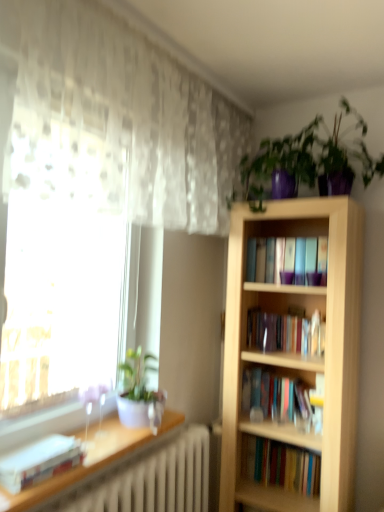
Locate an element on the screen. The image size is (384, 512). translucent fabric at left is located at coordinates (61, 301).

In order to click on light wood bookcase at right in this screenshot , I will do `click(296, 353)`.

The width and height of the screenshot is (384, 512). What are the coordinates of `shiny purple pot at upper right, which is counted as the 2th houseplant, starting from the bottom` in the screenshot? It's located at (310, 159).

From a real-world perspective, is white glossy shelf at lower left above or below shiny purple pot at upper right, the second houseplant positioned from the left?

Clearly, from a real-world perspective, white glossy shelf at lower left is below shiny purple pot at upper right, the second houseplant positioned from the left.

What's the angular difference between white glossy shelf at lower left and shiny purple pot at upper right, the first houseplant viewed from the top,'s facing directions?

There is a 89.1-degree angle between the facing directions of white glossy shelf at lower left and shiny purple pot at upper right, the first houseplant viewed from the top.

Is white glossy shelf at lower left spatially inside shiny purple pot at upper right, the first houseplant viewed from the top, or outside of it?

white glossy shelf at lower left cannot be found inside shiny purple pot at upper right, the first houseplant viewed from the top.

Based on the photo, is white glossy shelf at lower left looking in the opposite direction of shiny purple pot at upper right, the second houseplant positioned from the left?

No, white glossy shelf at lower left is not facing the opposite direction of shiny purple pot at upper right, the second houseplant positioned from the left.

Considering the points (133, 353) and (49, 489), which point is behind, point (133, 353) or point (49, 489)?

The point (133, 353) is more distant.

Which is more to the left, white glossy pot at left, marked as the 1th houseplant in a bottom-to-top arrangement, or white glossy shelf at lower left?

Positioned to the left is white glossy shelf at lower left.

From a real-world perspective, is white glossy pot at left, which appears as the first houseplant when viewed from the left, over white glossy shelf at lower left?

Yes, from a real-world perspective, white glossy pot at left, which appears as the first houseplant when viewed from the left, is above white glossy shelf at lower left.

Considering the positions of points (353, 261) and (106, 423), is point (353, 261) closer to camera compared to point (106, 423)?

No, (353, 261) is further to viewer.

From the image's perspective, which is above, light wood bookcase at right or white glossy shelf at lower left?

From the image's view, light wood bookcase at right is above.

Based on the photo, between light wood bookcase at right and white glossy shelf at lower left, which one appears on the left side from the viewer's perspective?

From the viewer's perspective, white glossy shelf at lower left appears more on the left side.

Looking at this image, how far apart are light wood bookcase at right and white glossy shelf at lower left?

The distance of light wood bookcase at right from white glossy shelf at lower left is 31.46 inches.

Considering the sizes of white glossy pot at left, marked as the 1th houseplant in a bottom-to-top arrangement, and shiny purple pot at upper right, marked as the 1th houseplant in a right-to-left arrangement, in the image, is white glossy pot at left, marked as the 1th houseplant in a bottom-to-top arrangement, taller or shorter than shiny purple pot at upper right, marked as the 1th houseplant in a right-to-left arrangement,?

white glossy pot at left, marked as the 1th houseplant in a bottom-to-top arrangement, is shorter than shiny purple pot at upper right, marked as the 1th houseplant in a right-to-left arrangement.

Is white glossy pot at left, which appears as the first houseplant when viewed from the left, looking in the opposite direction of shiny purple pot at upper right, marked as the 1th houseplant in a right-to-left arrangement?

That's not correct — white glossy pot at left, which appears as the first houseplant when viewed from the left, is not looking away from shiny purple pot at upper right, marked as the 1th houseplant in a right-to-left arrangement.

From the image's perspective, is white glossy pot at left, marked as the 2th houseplant in a right-to-left arrangement, located above or below shiny purple pot at upper right, the second houseplant positioned from the left?

From the image's perspective, white glossy pot at left, marked as the 2th houseplant in a right-to-left arrangement, appears below shiny purple pot at upper right, the second houseplant positioned from the left.

From a real-world perspective, between light wood bookcase at right and white glossy pot at left, marked as the 2th houseplant in a right-to-left arrangement, who is vertically lower?

light wood bookcase at right.

Considering the positions of objects light wood bookcase at right and white glossy pot at left, marked as the 2th houseplant in a top-to-bottom arrangement, in the image provided, who is more to the left, light wood bookcase at right or white glossy pot at left, marked as the 2th houseplant in a top-to-bottom arrangement,?

white glossy pot at left, marked as the 2th houseplant in a top-to-bottom arrangement, is more to the left.

From the image's perspective, is light wood bookcase at right beneath white glossy pot at left, which appears as the first houseplant when viewed from the left?

Yes, from the image's perspective, light wood bookcase at right is below white glossy pot at left, which appears as the first houseplant when viewed from the left.

Is shiny purple pot at upper right, the first houseplant viewed from the top, smaller than white matte book at lower left?

No.

Is shiny purple pot at upper right, marked as the 1th houseplant in a right-to-left arrangement, facing away from white matte book at lower left?

No.

Starting from the white matte book at lower left, which houseplant is the 2nd one to the right? Please provide its 2D coordinates.

[(310, 159)]

From the picture: How different are the orientations of shiny purple pot at upper right, the first houseplant viewed from the top, and white matte book at lower left in degrees?

89.1 degrees.

Is white matte book at lower left far away from white glossy pot at left, marked as the 1th houseplant in a bottom-to-top arrangement?

No, white matte book at lower left is not far from white glossy pot at left, marked as the 1th houseplant in a bottom-to-top arrangement.

Considering the relative positions of white matte book at lower left and white glossy pot at left, marked as the 1th houseplant in a bottom-to-top arrangement, in the image provided, is white matte book at lower left to the left or to the right of white glossy pot at left, marked as the 1th houseplant in a bottom-to-top arrangement,?

white matte book at lower left is to the left of white glossy pot at left, marked as the 1th houseplant in a bottom-to-top arrangement.

From a real-world perspective, is white matte book at lower left physically located above or below white glossy pot at left, marked as the 2th houseplant in a right-to-left arrangement?

Clearly, from a real-world perspective, white matte book at lower left is below white glossy pot at left, marked as the 2th houseplant in a right-to-left arrangement.

Looking at the image, does white matte book at lower left seem bigger or smaller compared to white glossy pot at left, which appears as the first houseplant when viewed from the left?

Clearly, white matte book at lower left is smaller in size than white glossy pot at left, which appears as the first houseplant when viewed from the left.

Locate an element on the screen. shelf below the shiny purple pot at upper right, the first houseplant viewed from the top (from a real-world perspective) is located at coordinates (80, 466).

From the image's perspective, starting from the white glossy shelf at lower left, which houseplant is the 1st one above? Please provide its 2D coordinates.

[(139, 393)]

Estimate the real-world distances between objects in this image. Which object is further from translucent fabric at left, white glossy shelf at lower left or shiny purple pot at upper right, the second houseplant positioned from the left?

shiny purple pot at upper right, the second houseplant positioned from the left.

Estimate the real-world distances between objects in this image. Which object is closer to white glossy shelf at lower left, white glossy pot at left, which appears as the first houseplant when viewed from the left, or light wood bookcase at right?

The object closer to white glossy shelf at lower left is white glossy pot at left, which appears as the first houseplant when viewed from the left.

Based on their spatial positions, is white matte book at lower left or white glossy shelf at lower left further from translucent fabric at left?

Among the two, white matte book at lower left is located further to translucent fabric at left.

Considering their positions, is light wood bookcase at right positioned further to white matte book at lower left than white glossy pot at left, which appears as the first houseplant when viewed from the left?

light wood bookcase at right lies further to white matte book at lower left than the other object.

Considering their positions, is white matte book at lower left positioned closer to shiny purple pot at upper right, the first houseplant viewed from the top, than light wood bookcase at right?

light wood bookcase at right.

Estimate the real-world distances between objects in this image. Which object is closer to white glossy pot at left, marked as the 1th houseplant in a bottom-to-top arrangement, translucent fabric at left or shiny purple pot at upper right, which is counted as the 2th houseplant, starting from the bottom?

Based on the image, translucent fabric at left appears to be nearer to white glossy pot at left, marked as the 1th houseplant in a bottom-to-top arrangement.

Estimate the real-world distances between objects in this image. Which object is further from white glossy pot at left, marked as the 2th houseplant in a top-to-bottom arrangement, white glossy shelf at lower left or light wood bookcase at right?

Among the two, light wood bookcase at right is located further to white glossy pot at left, marked as the 2th houseplant in a top-to-bottom arrangement.

From the image, which object appears to be nearer to translucent fabric at left, light wood bookcase at right or white glossy shelf at lower left?

white glossy shelf at lower left.

The height and width of the screenshot is (512, 384). Identify the location of shelf between white matte book at lower left and light wood bookcase at right in the horizontal direction. (80, 466).

Locate an element on the screen. shelf between translucent fabric at left and shiny purple pot at upper right, which is counted as the 2th houseplant, starting from the bottom, from left to right is located at coordinates (80, 466).

This screenshot has height=512, width=384. Find the location of `houseplant between translucent fabric at left and white matte book at lower left from top to bottom`. houseplant between translucent fabric at left and white matte book at lower left from top to bottom is located at coordinates (139, 393).

The image size is (384, 512). Find the location of `shelf between translucent fabric at left and light wood bookcase at right`. shelf between translucent fabric at left and light wood bookcase at right is located at coordinates (80, 466).